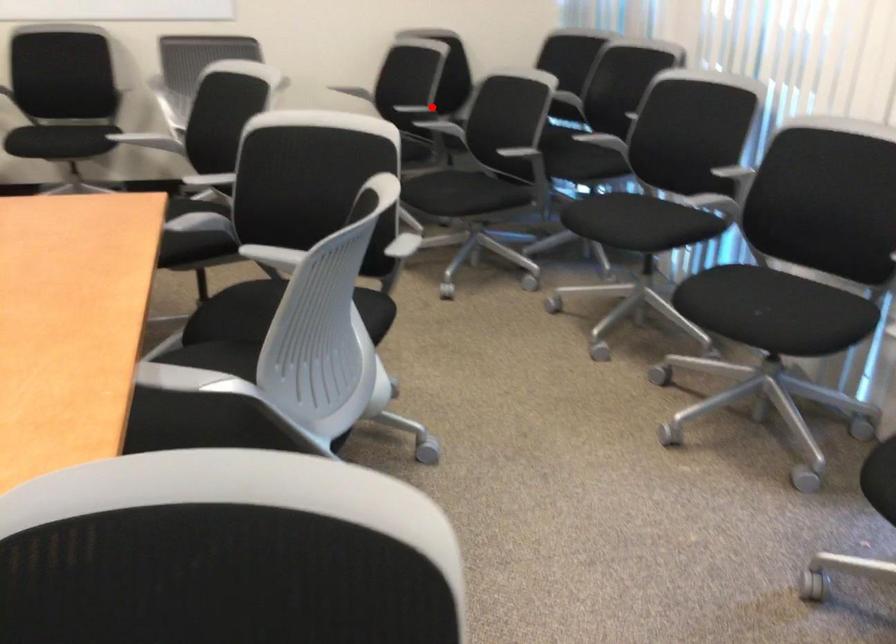
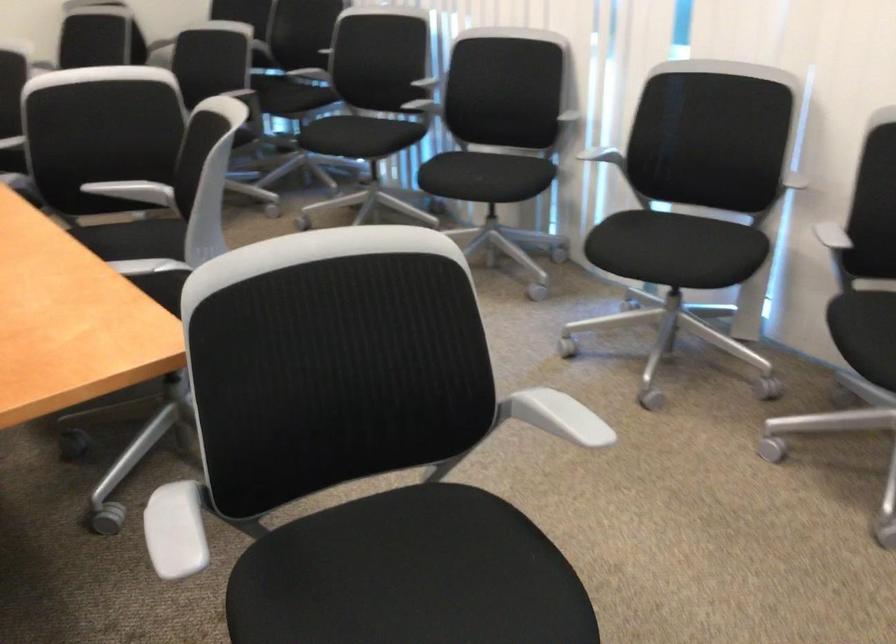
Question: I am providing you with two images of the same scene from different viewpoints. A red point is marked on the first image. At the location where the point appears in image 1, is it still visible in image 2?

Choices:
 (A) Yes
 (B) No

Answer: (B)